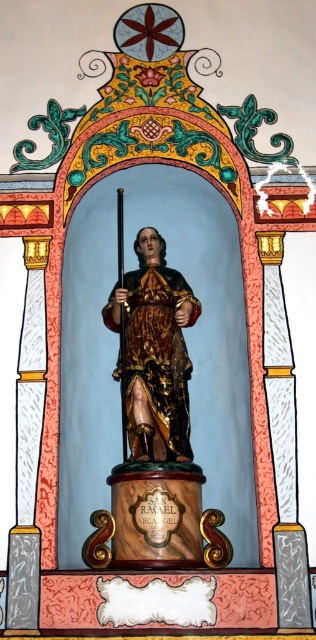
Is gold polished statue at center positioned before gold/ornate fabric robe at center?

Yes, gold polished statue at center is in front of gold/ornate fabric robe at center.

Can you confirm if gold polished statue at center is taller than gold/ornate fabric robe at center?

Correct, gold polished statue at center is much taller as gold/ornate fabric robe at center.

Image resolution: width=316 pixels, height=640 pixels. What do you see at coordinates (155, 420) in the screenshot?
I see `gold polished statue at center` at bounding box center [155, 420].

The height and width of the screenshot is (640, 316). Identify the location of gold polished statue at center. (155, 420).